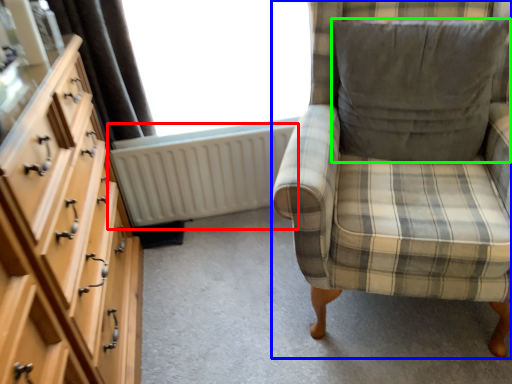
Question: Which is farther away from radiator (highlighted by a red box)? furniture (highlighted by a blue box) or pillow (highlighted by a green box)?

Choices:
 (A) furniture
 (B) pillow

Answer: (A)